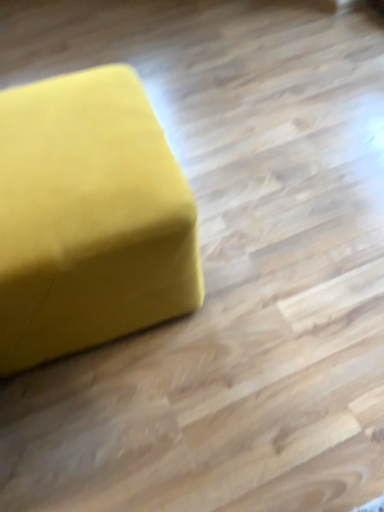
Identify the location of free point above matte yellow ottoman at left (from a real-world perspective). (63, 141).